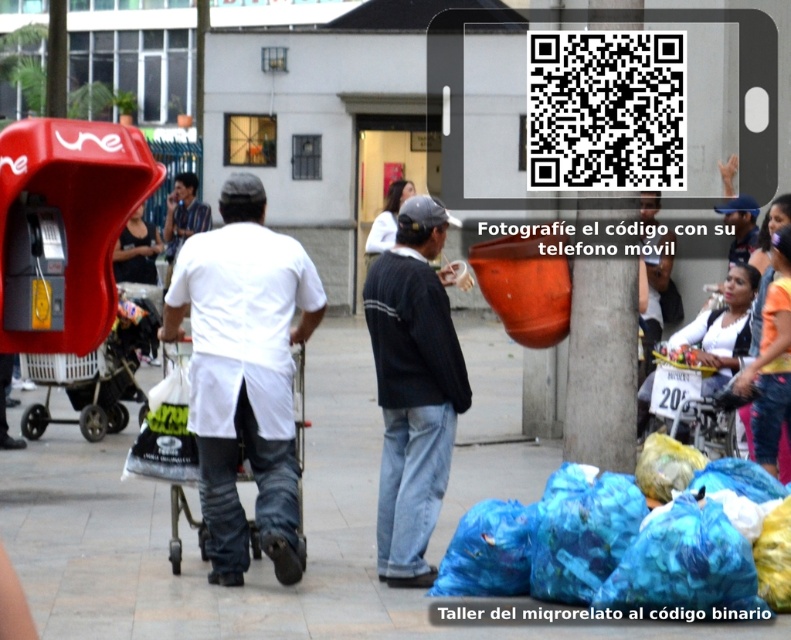
You are standing at the point marked by the coordinates point (244,374) in the image. Which object from the scene is directly in front of you?

The point (244,374) is located on the white matte shirt at center, so the object directly in front of you is the white matte shirt at center.

You are a pedestrian standing at the crosswalk and see the dark blue sweater at center and the dark blue jeans at lower right. Which one is located more to the left?

The dark blue sweater at center is more to the left than the dark blue jeans at lower right.